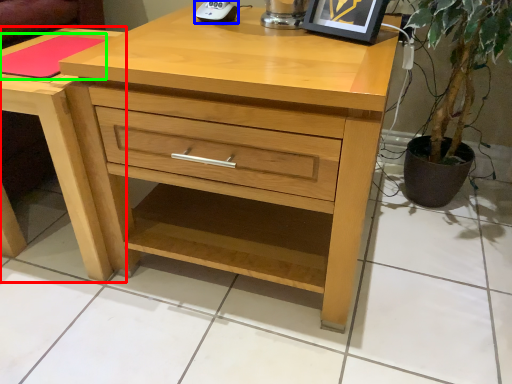
Question: Which object is positioned closest to nightstand (highlighted by a red box)? Select from gadget (highlighted by a blue box) and pad (highlighted by a green box).

Choices:
 (A) gadget
 (B) pad

Answer: (B)